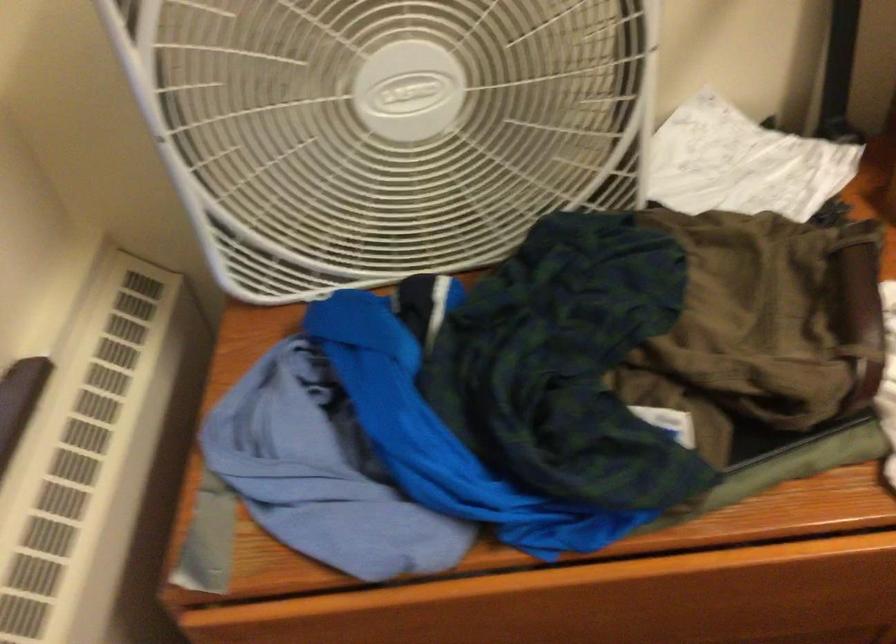
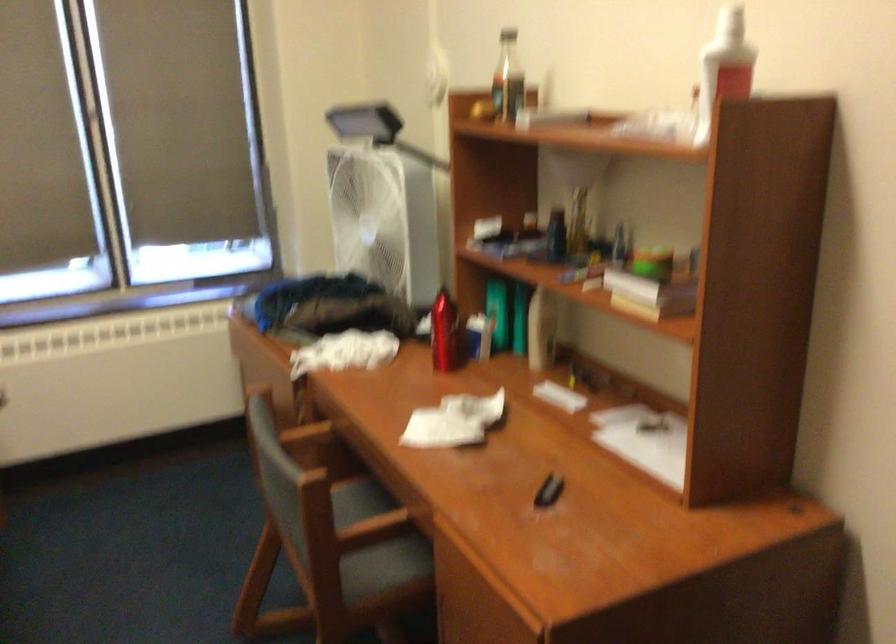
Question: I am providing you with two images of the same scene from different viewpoints. Please identify which objects are invisible in image2.

Choices:
 (A) white spray bottle
 (B) chair armrest
 (C) crumpled white paper
 (D) white rod

Answer: (C)